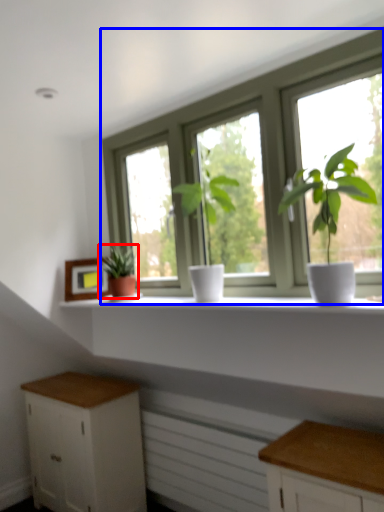
Question: Which point is closer to the camera, houseplant (highlighted by a red box) or window (highlighted by a blue box)?

Choices:
 (A) houseplant
 (B) window

Answer: (B)